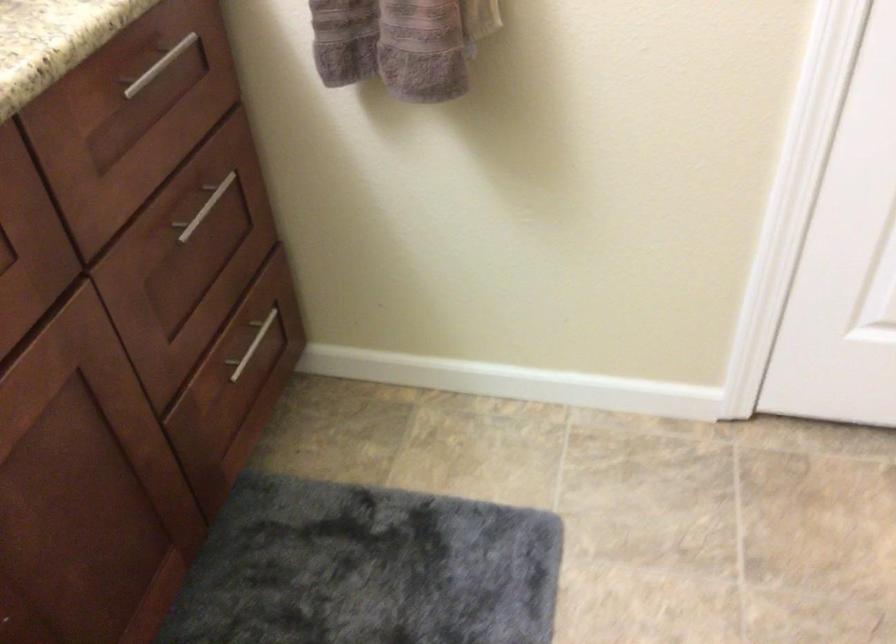
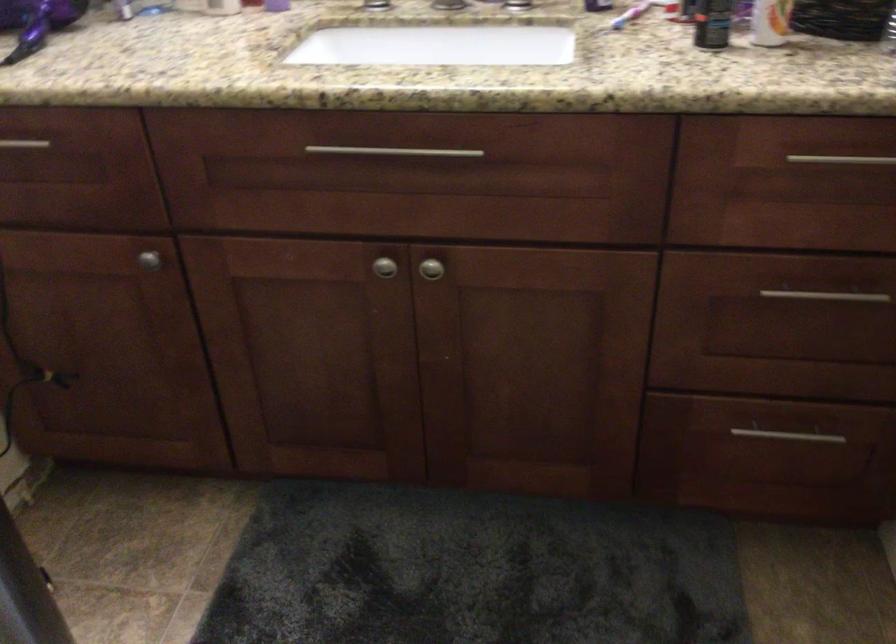
In the second image, find the point that corresponds to (205,228) in the first image.

(815, 310)